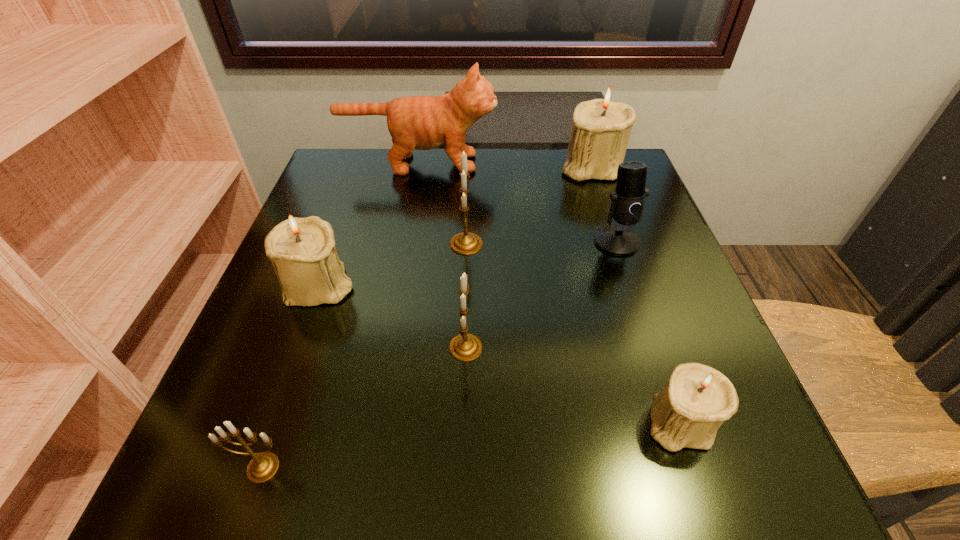
At what (x,y) coordinates should I click in order to perform the action: click on empty location between the second smallest beige candle_holder and the nearest beige candle_holder. Please return your answer as a coordinate pair (x, y). Image resolution: width=960 pixels, height=540 pixels. Looking at the image, I should click on (499, 353).

Locate an element on the screen. vacant area that lies between the nearest gold candelabrum and the biggest beige candle_holder is located at coordinates (427, 317).

Where is `free space between the cat and the black microphone`? This screenshot has width=960, height=540. free space between the cat and the black microphone is located at coordinates (517, 202).

What are the coordinates of `free space that is in between the second nearest beige candle_holder and the leftmost gold candelabrum` in the screenshot? It's located at (291, 375).

Locate which object is the fifth closest to the second smallest beige candle_holder. Please provide its 2D coordinates. Your answer should be formatted as a tuple, i.e. [(x, y)], where the tuple contains the x and y coordinates of a point satisfying the conditions above.

[(627, 204)]

What are the coordinates of `object that stands as the second closest to the leftmost gold candelabrum` in the screenshot? It's located at (302, 251).

Identify which candelabrum is located as the nearest to the farthest beige candle_holder. Please provide its 2D coordinates. Your answer should be formatted as a tuple, i.e. [(x, y)], where the tuple contains the x and y coordinates of a point satisfying the conditions above.

[(466, 243)]

Identify which candelabrum is the fourth closest to the microphone. Please provide its 2D coordinates. Your answer should be formatted as a tuple, i.e. [(x, y)], where the tuple contains the x and y coordinates of a point satisfying the conditions above.

[(695, 401)]

At what (x,y) coordinates should I click in order to perform the action: click on beige candle_holder object that ranks as the third closest to the smallest gold candelabrum. Please return your answer as a coordinate pair (x, y). Looking at the image, I should click on (601, 129).

Point out which beige candle_holder is positioned as the third nearest to the biggest gold candelabrum. Please provide its 2D coordinates. Your answer should be formatted as a tuple, i.e. [(x, y)], where the tuple contains the x and y coordinates of a point satisfying the conditions above.

[(695, 401)]